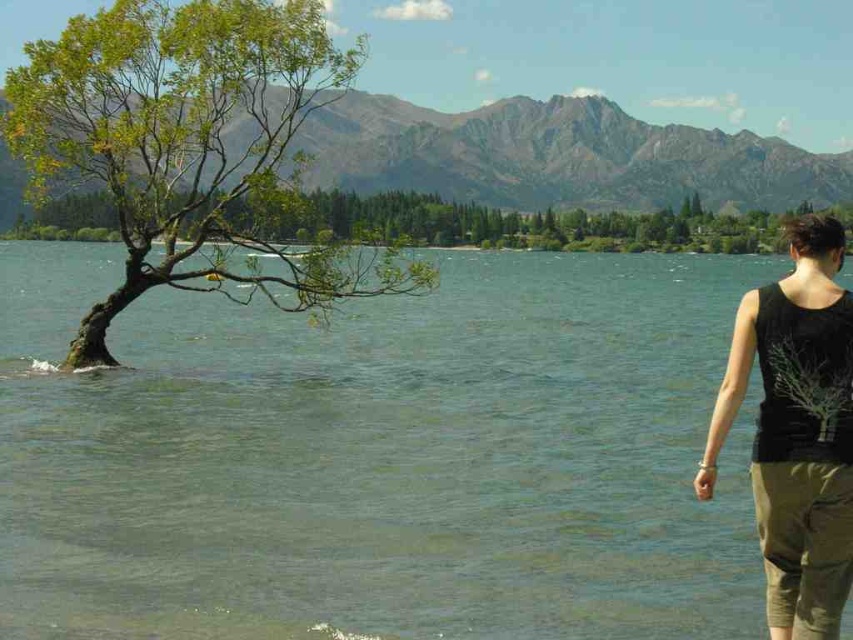
Question: Is green leafy tree at left further to the viewer compared to black cotton tank top at right?

Choices:
 (A) yes
 (B) no

Answer: (A)

Question: Can you confirm if clear water at center is positioned above green leafy tree at center?

Choices:
 (A) no
 (B) yes

Answer: (A)

Question: Is black cotton tank top at right to the left of green leafy tree at center from the viewer's perspective?

Choices:
 (A) yes
 (B) no

Answer: (B)

Question: Which point is closer to the camera taking this photo?

Choices:
 (A) (814, 486)
 (B) (30, 44)

Answer: (A)

Question: Which object appears closest to the camera in this image?

Choices:
 (A) black cotton tank top at right
 (B) green leafy tree at left
 (C) clear water at center
 (D) green leafy tree at center

Answer: (A)

Question: Which of the following is the closest to the observer?

Choices:
 (A) [316, 225]
 (B) [312, 621]
 (C) [817, 227]

Answer: (C)